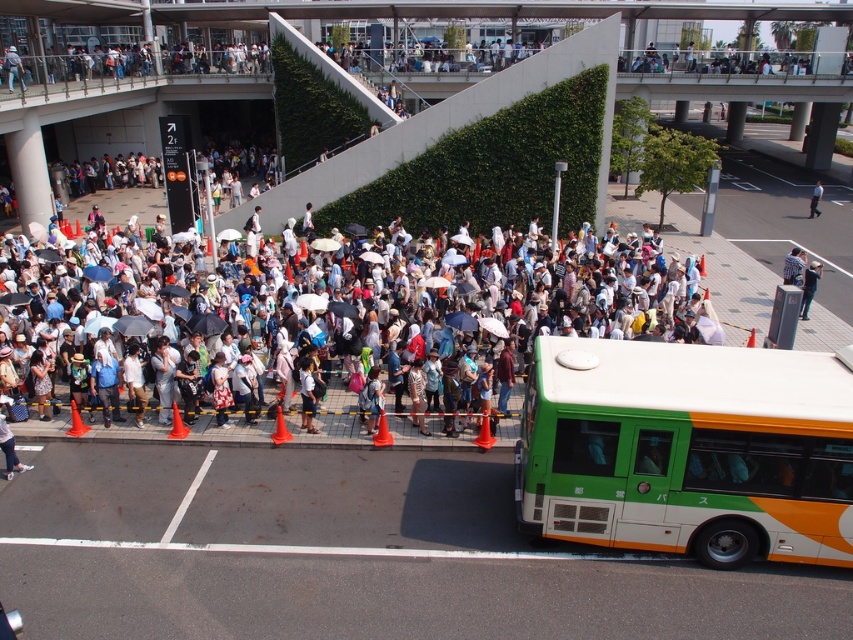
You are a photographer standing at the edge of the scene. You want to take a photo of the white fabric shirt at center without the matte white crowd at center appearing in the foreground. Is this possible given their positions?

The matte white crowd at center is located below the white fabric shirt at center, so if you position yourself above the crowd, you can capture the shirt without the crowd blocking it.

You are a photographer standing at the back of the crowd. You want to take a photo of the light blue fabric jacket at center without the matte white crowd at center blocking it. Is this possible?

The matte white crowd at center is above the light blue fabric jacket at center, so the crowd is blocking the jacket. Therefore, it is not possible to take a photo of the light blue fabric jacket at center without the matte white crowd at center blocking it.